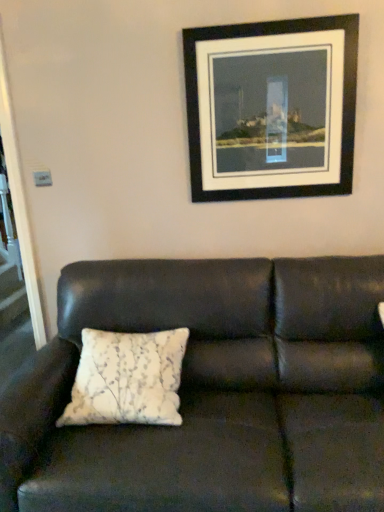
Question: Is leather couch at center wider or thinner than white textured pillow at center?

Choices:
 (A) thin
 (B) wide

Answer: (B)

Question: Is point click(x=319, y=489) positioned closer to the camera than point click(x=173, y=415)?

Choices:
 (A) farther
 (B) closer

Answer: (B)

Question: Estimate the real-world distances between objects in this image. Which object is farther from the black matte picture frame at upper center?

Choices:
 (A) white textured pillow at center
 (B) leather couch at center

Answer: (A)

Question: Which object is positioned closest to the black matte picture frame at upper center?

Choices:
 (A) leather couch at center
 (B) white textured pillow at center

Answer: (A)